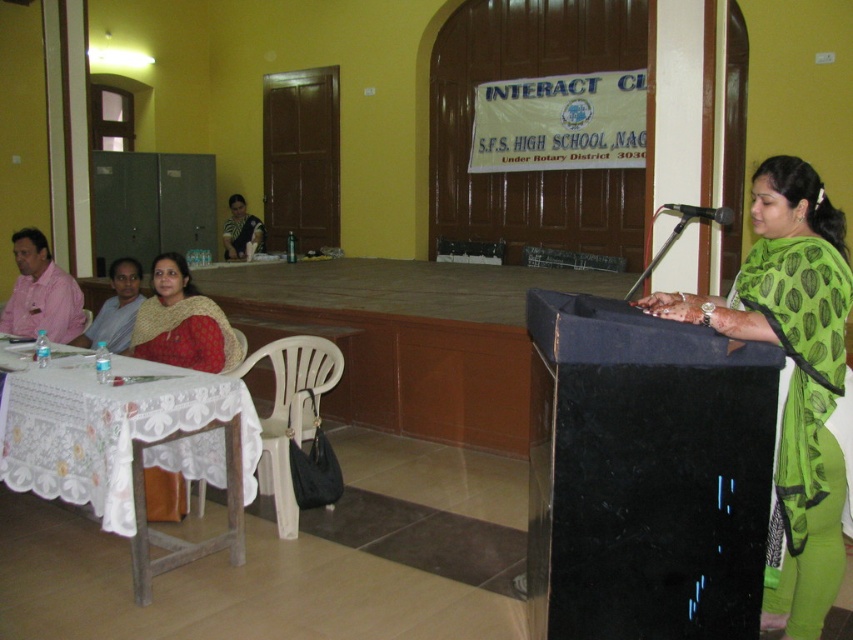
You are standing in the auditorium and want to take a photo that includes both the woman behind the black podium and the banner on the door. Which of the two points, point (65, 358) or point (47, 257), is closer to the camera to ensure both subjects are in focus?

Point (65, 358) is closer to the camera than point (47, 257). To ensure both the woman behind the black podium and the banner on the door are in focus, you should focus on the closer point, which is point (65, 358).

Consider the image. You are an event planner arranging decorations for the upcoming presentation. You need to place a decorative centerpiece on the white lace tablecloth at lower left and ensure it doesn not obstruct the matte pink shirt at left. Based on their positions, can you place the centerpiece without blocking the view of the shirt?

The white lace tablecloth at lower left is below the matte pink shirt at left, so placing the centerpiece on the tablecloth will not block the view of the matte pink shirt at left as it is positioned lower.

Consider the image. You are an event planner setting up the venue. You need to place a decorative item on the white lace tablecloth at lower left and the matte pink shirt at left. Which surface can accommodate a larger item?

The white lace tablecloth at lower left can accommodate a larger item because it is bigger than the matte pink shirt at left.